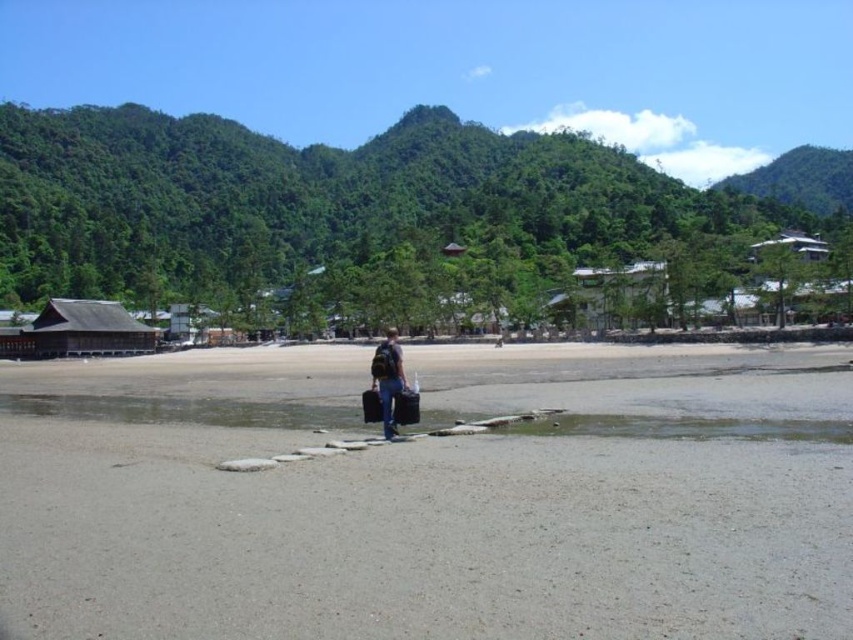
You are a photographer trying to capture the entire scene in one shot. Given that the dark blue jeans at center are narrower than the green leafy forest at upper left, which object should you focus on to ensure both are visible in the frame?

To ensure both the dark blue jeans at center and the green leafy forest at upper left are visible in the frame, focus on the green leafy forest at upper left since it is wider and can accommodate the narrower dark blue jeans at center within the same shot.

Consider the image. You are standing at the edge of the beach and see the clear water at center and the dark blue jeans at center. Which object is closer to your right side?

The dark blue jeans at center is to the right of the clear water at center, so the dark blue jeans at center is closer to your right side.

You are standing at the point with coordinates point (28,394) and want to walk to the point with coordinates point (846,518). Which direction should you face to walk directly towards your destination?

You should face north because point (846,518) is in front of point (28,394).